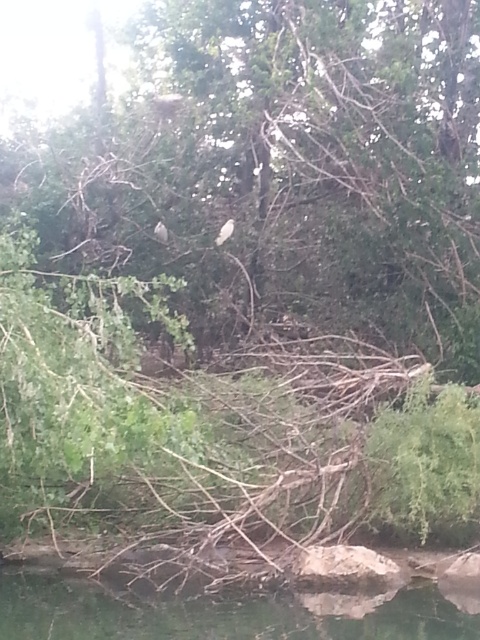
Does point (412, 32) come in front of point (226, 230)?

Yes, it is in front of point (226, 230).

Is green leafy tree at center thinner than white matte bird at upper center?

No.

Does point (457, 125) lie behind point (229, 230)?

Yes.

Identify the location of green leafy tree at center. (279, 166).